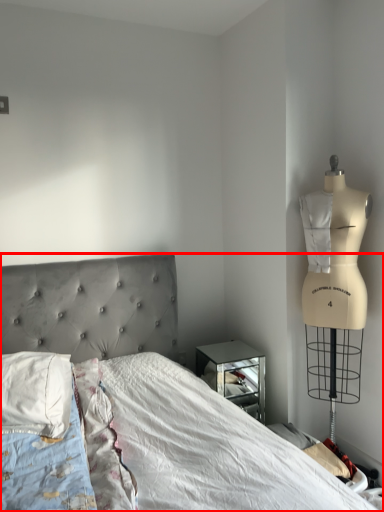
Question: From the image's perspective, what is the correct spatial relationship of bed (annotated by the red box) in relation to pillow?

Choices:
 (A) above
 (B) below

Answer: (B)